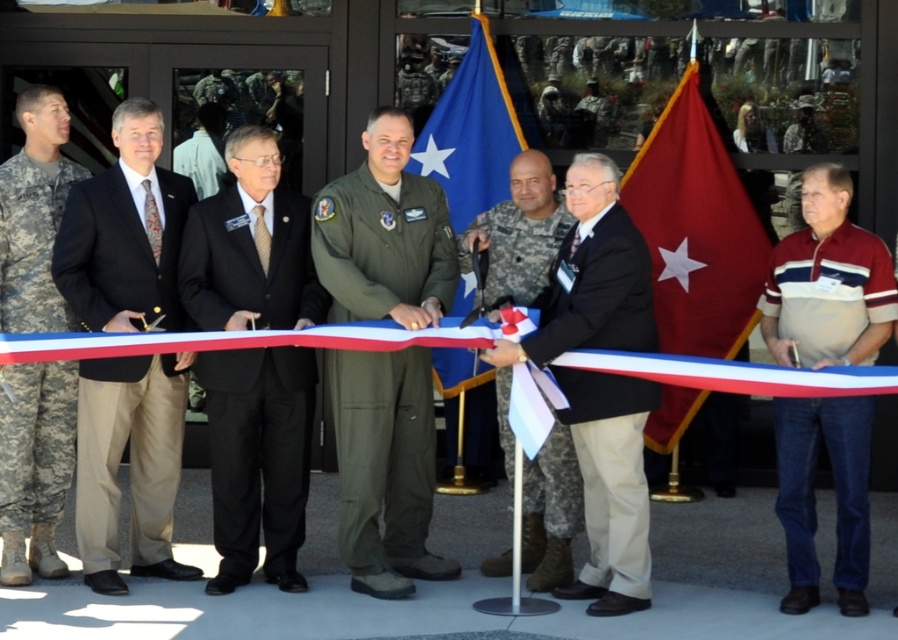
Based on the scene description, where is the red fabric flag at center located in terms of its 2D coordinates?

The red fabric flag at center is located at the 2D coordinates of point [696,228].

What is located at the coordinates point (610, 484) in the image?

The black fabric suit at center is located at point (610, 484).